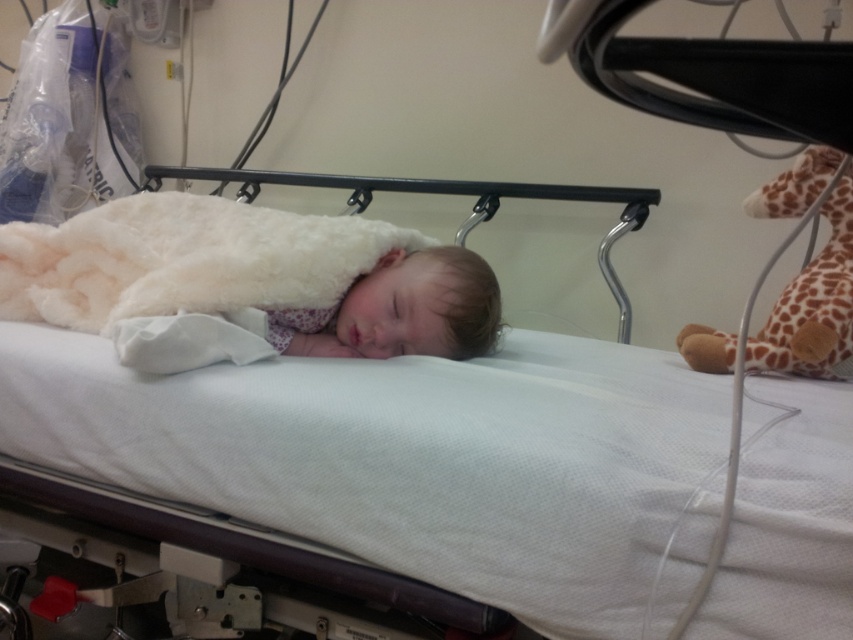
This screenshot has height=640, width=853. What do you see at coordinates (418, 461) in the screenshot? I see `white fabric infant bed at center` at bounding box center [418, 461].

The height and width of the screenshot is (640, 853). In order to click on white fabric infant bed at center in this screenshot , I will do `click(418, 461)`.

Locate an element on the screen. The image size is (853, 640). white fabric infant bed at center is located at coordinates (418, 461).